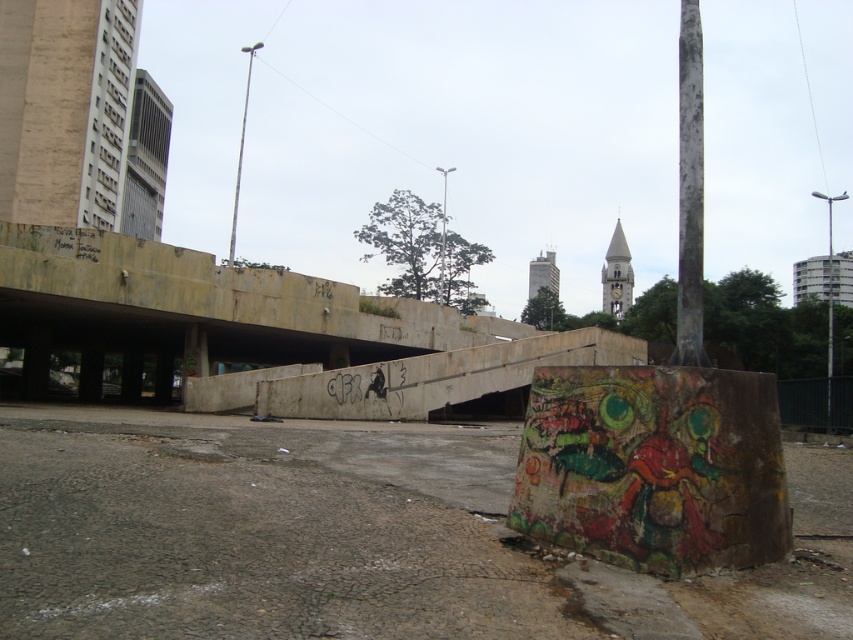
You are a pedestrian standing in the urban scene. You see the white weathered pole at right and the gray concrete building at upper left. Which object is positioned more to the east if the sun is setting in the west?

The gray concrete building at upper left is positioned more to the east because the white weathered pole at right is to the right of it, and since the sun is setting in the west, the right side of the scene would be facing west.

You are standing in the urban scene and want to move from the point closer to you to the point further away. Which path would you take between the two points, point (607,310) and point (445,176)?

The path from point (607,310) to point (445,176) requires moving away from the viewer since point (607,310) is closer to the viewer than point (445,176).